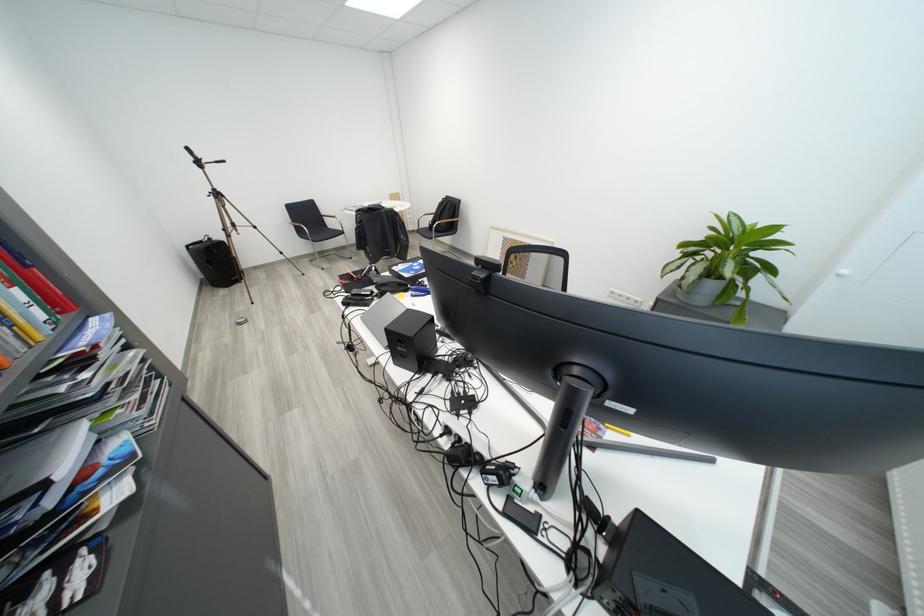
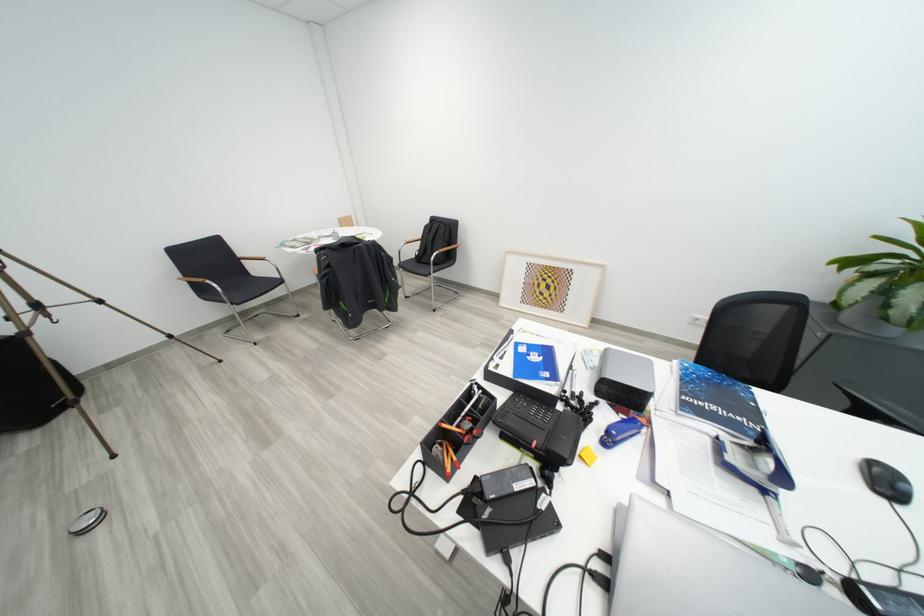
Find the pixel in the second image that matches [250,323] in the first image.

(96, 524)